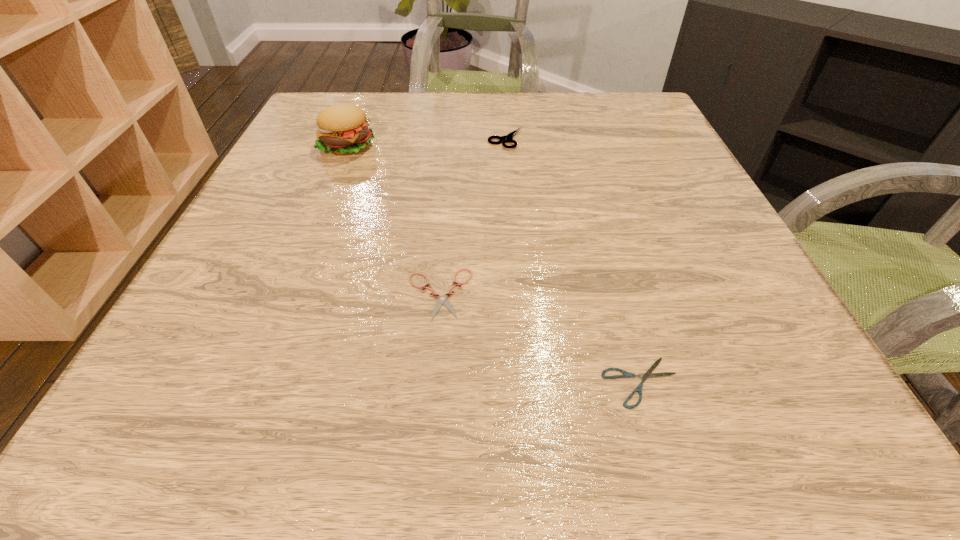
Where is `vacant space at the far left corner`? vacant space at the far left corner is located at coordinates (372, 112).

At what (x,y) coordinates should I click in order to perform the action: click on free point between the second object from right to left and the second object from left to right. Please return your answer as a coordinate pair (x, y). This screenshot has width=960, height=540. Looking at the image, I should click on (472, 217).

I want to click on empty space that is in between the shortest shears and the hamburger, so click(x=494, y=264).

The image size is (960, 540). What are the coordinates of `free point between the third shortest object and the nearest object` in the screenshot? It's located at (573, 261).

The image size is (960, 540). I want to click on empty space between the second shears from right to left and the nearest shears, so click(573, 261).

I want to click on empty space that is in between the second shortest shears and the leftmost object, so click(394, 220).

The image size is (960, 540). What are the coordinates of `vacant space that's between the second object from right to left and the rightmost object` in the screenshot? It's located at (573, 261).

You are a GUI agent. You are given a task and a screenshot of the screen. Output one action in this format:
    pyautogui.click(x=<x>, y=<y>)
    Task: Click on the vacant space that is in between the hamburger and the tallest shears
    The width and height of the screenshot is (960, 540).
    Given the screenshot: What is the action you would take?
    pyautogui.click(x=426, y=142)

Identify the location of free space between the third object from right to left and the second object from right to left. (472, 217).

Find the location of a particular element. The width and height of the screenshot is (960, 540). blank region between the leftmost shears and the tallest object is located at coordinates (394, 220).